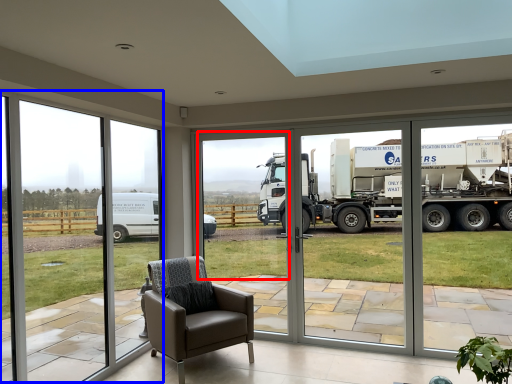
Question: Which object appears farthest to the camera in this image, window screen (highlighted by a red box) or window frame (highlighted by a blue box)?

Choices:
 (A) window screen
 (B) window frame

Answer: (A)